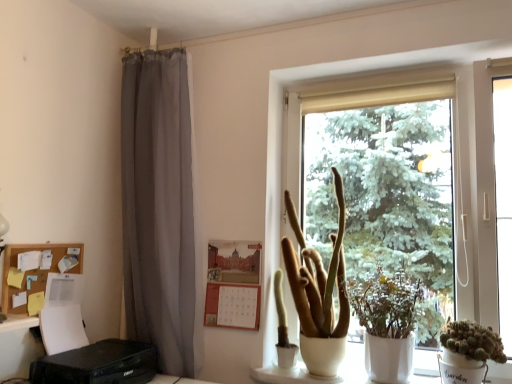
Question: Could you tell me if green matte plant at center, the second houseplant viewed from the left, is facing white matte window at center?

Choices:
 (A) no
 (B) yes

Answer: (A)

Question: Is green matte plant at center, the second houseplant viewed from the left, shorter than white matte window at center?

Choices:
 (A) no
 (B) yes

Answer: (B)

Question: From a real-world perspective, is green matte plant at center, the second houseplant viewed from the left, located beneath white matte window at center?

Choices:
 (A) no
 (B) yes

Answer: (B)

Question: Can you confirm if green matte plant at center, the 2th houseplant in the right-to-left sequence, is smaller than white matte window at center?

Choices:
 (A) yes
 (B) no

Answer: (A)

Question: Is green matte plant at center, the 2th houseplant in the right-to-left sequence, not within white matte window at center?

Choices:
 (A) no
 (B) yes

Answer: (A)

Question: Does point (276, 279) appear closer or farther from the camera than point (2, 297)?

Choices:
 (A) closer
 (B) farther

Answer: (B)

Question: Would you say green matte cactus at center is to the left or to the right of corkboard paper at left in the picture?

Choices:
 (A) left
 (B) right

Answer: (B)

Question: From their relative heights in the image, would you say green matte cactus at center is taller or shorter than corkboard paper at left?

Choices:
 (A) tall
 (B) short

Answer: (A)

Question: Is green matte cactus at center situated inside corkboard paper at left or outside?

Choices:
 (A) outside
 (B) inside

Answer: (A)

Question: From a real-world perspective, is green matte plant at center, the 2th houseplant in the right-to-left sequence, above or below green matte cactus at center?

Choices:
 (A) above
 (B) below

Answer: (A)

Question: In terms of size, does green matte plant at center, the second houseplant viewed from the left, appear bigger or smaller than green matte cactus at center?

Choices:
 (A) small
 (B) big

Answer: (B)

Question: From their relative heights in the image, would you say green matte plant at center, the 2th houseplant in the right-to-left sequence, is taller or shorter than green matte cactus at center?

Choices:
 (A) tall
 (B) short

Answer: (A)

Question: Considering their positions, is green matte plant at center, the 2th houseplant in the right-to-left sequence, located in front of or behind green matte cactus at center?

Choices:
 (A) behind
 (B) front

Answer: (B)

Question: Considering the positions of white matte window at center and corkboard paper at left in the image, is white matte window at center taller or shorter than corkboard paper at left?

Choices:
 (A) short
 (B) tall

Answer: (B)

Question: From the image's perspective, is white matte window at center above or below corkboard paper at left?

Choices:
 (A) below
 (B) above

Answer: (B)